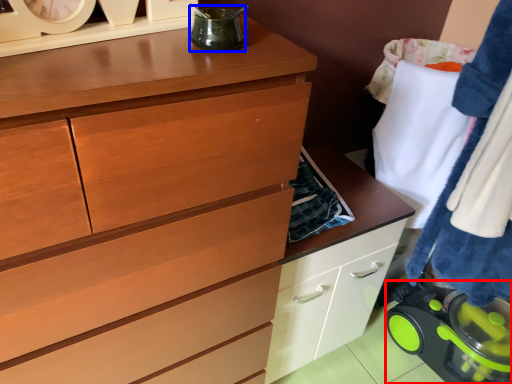
Question: Which object appears closest to the camera in this image, appliance (highlighted by a red box) or appliance (highlighted by a blue box)?

Choices:
 (A) appliance
 (B) appliance

Answer: (B)